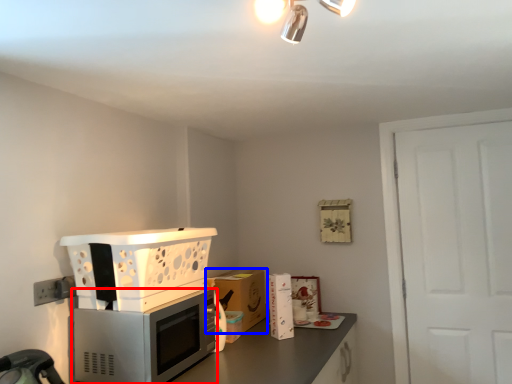
Question: Among these objects, which one is farthest to the camera, home appliance (highlighted by a red box) or cabinetry (highlighted by a blue box)?

Choices:
 (A) home appliance
 (B) cabinetry

Answer: (B)